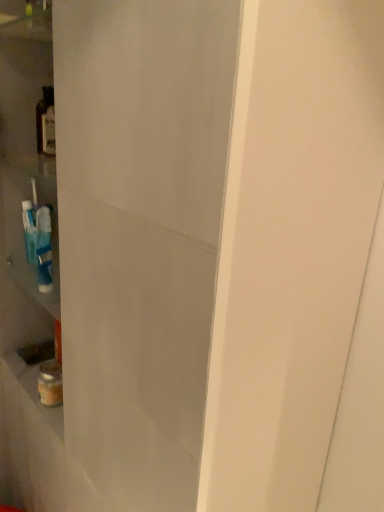
Question: Is translucent glass bottle at left not within transparent glass door at center?

Choices:
 (A) yes
 (B) no

Answer: (B)

Question: Is translucent glass bottle at left taller than transparent glass door at center?

Choices:
 (A) yes
 (B) no

Answer: (B)

Question: Is translucent glass bottle at left not near transparent glass door at center?

Choices:
 (A) no
 (B) yes

Answer: (A)

Question: Is translucent glass bottle at left bigger than transparent glass door at center?

Choices:
 (A) yes
 (B) no

Answer: (B)

Question: Is translucent glass bottle at left smaller than transparent glass door at center?

Choices:
 (A) yes
 (B) no

Answer: (A)

Question: Is translucent glass bottle at left thinner than transparent glass door at center?

Choices:
 (A) yes
 (B) no

Answer: (A)

Question: From a real-world perspective, is transparent glass door at center on translucent glass bottle at left?

Choices:
 (A) no
 (B) yes

Answer: (A)

Question: Does transparent glass door at center touch translucent glass bottle at left?

Choices:
 (A) no
 (B) yes

Answer: (A)

Question: Does transparent glass door at center lie behind translucent glass bottle at left?

Choices:
 (A) no
 (B) yes

Answer: (A)

Question: Can you confirm if transparent glass door at center is shorter than translucent glass bottle at left?

Choices:
 (A) yes
 (B) no

Answer: (B)

Question: Is transparent glass door at center oriented towards translucent glass bottle at left?

Choices:
 (A) no
 (B) yes

Answer: (B)

Question: Considering the relative sizes of transparent glass door at center and translucent glass bottle at left in the image provided, is transparent glass door at center thinner than translucent glass bottle at left?

Choices:
 (A) no
 (B) yes

Answer: (A)

Question: Does point (92, 26) appear closer or farther from the camera than point (44, 135)?

Choices:
 (A) farther
 (B) closer

Answer: (B)